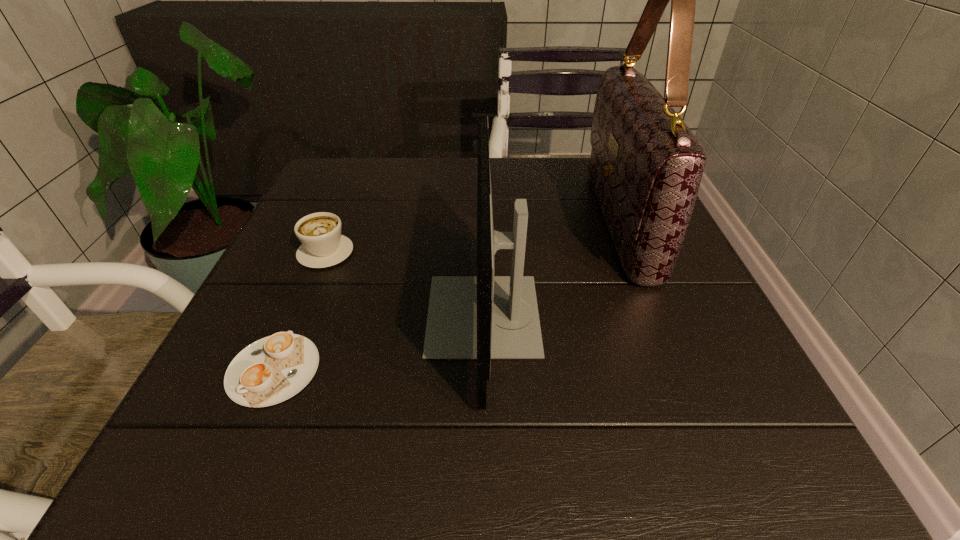
This screenshot has height=540, width=960. I want to click on the rightmost object, so click(646, 165).

The height and width of the screenshot is (540, 960). Find the location of `the tallest object`. the tallest object is located at coordinates (646, 165).

This screenshot has height=540, width=960. What are the coordinates of `the second tallest object` in the screenshot? It's located at (483, 317).

Locate an element on the screen. This screenshot has width=960, height=540. the second object from right to left is located at coordinates (483, 317).

In order to click on the taller cappuccino in this screenshot , I will do `click(323, 245)`.

Locate an element on the screen. the farther cappuccino is located at coordinates (323, 245).

The image size is (960, 540). I want to click on the shortest object, so click(273, 369).

This screenshot has width=960, height=540. Find the location of `the nearer cappuccino`. the nearer cappuccino is located at coordinates point(273,369).

This screenshot has height=540, width=960. Find the location of `free space located on the front of the rightmost object with the clasp`. free space located on the front of the rightmost object with the clasp is located at coordinates tap(476, 221).

Where is `vacant space located on the front of the rightmost object with the clasp`? The width and height of the screenshot is (960, 540). vacant space located on the front of the rightmost object with the clasp is located at coordinates (540, 221).